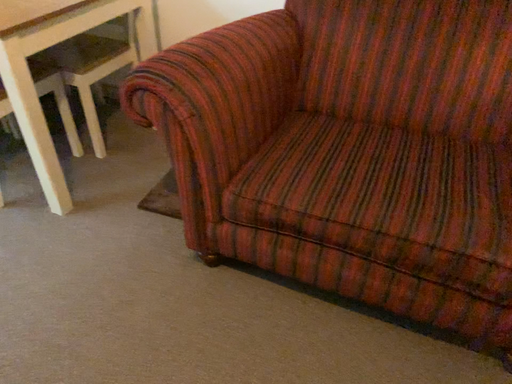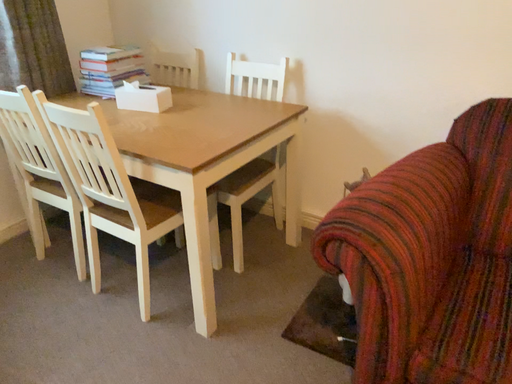
Question: Which way did the camera rotate in the video?

Choices:
 (A) rotated right
 (B) rotated left

Answer: (B)